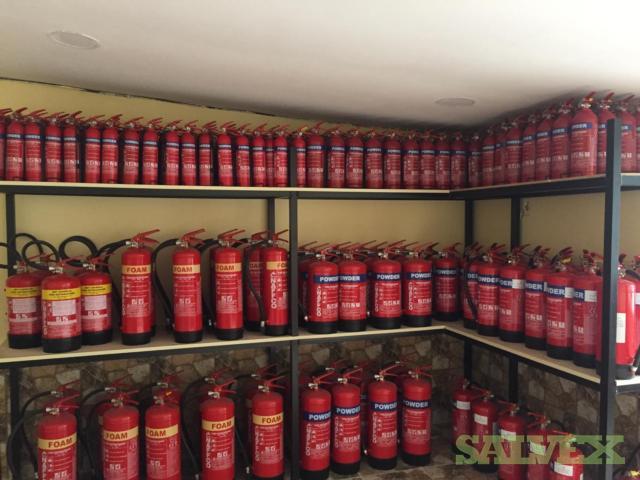
The height and width of the screenshot is (480, 640). In order to click on light gray ceiling in this screenshot , I will do `click(333, 57)`.